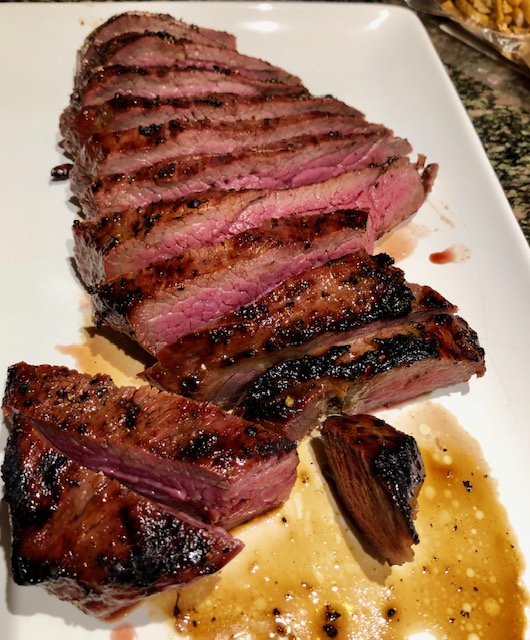
At what (x,y) coordinates should I click in order to perform the action: click on sauce stain. Please return your answer as a coordinate pair (x, y). Looking at the image, I should click on (449, 253), (444, 218), (401, 243), (102, 351), (123, 632), (195, 612), (329, 620), (476, 534).